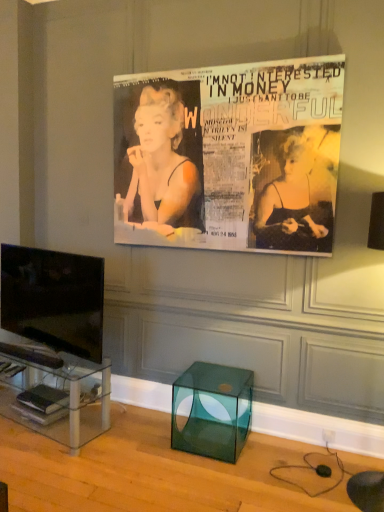
Question: In the image, is matte black poster at upper center on the left side or the right side of hardcover book at lower left, marked as the first magazine in a bottom-to-top arrangement?

Choices:
 (A) right
 (B) left

Answer: (A)

Question: Is point (236, 65) positioned closer to the camera than point (34, 414)?

Choices:
 (A) closer
 (B) farther

Answer: (A)

Question: Estimate the real-world distances between objects in this image. Which object is closer to the clear glass tv stand at lower left?

Choices:
 (A) hardcover book at lower left, marked as the first magazine in a bottom-to-top arrangement
 (B) matte black magazine at lower left, placed as the 2th magazine when sorted from bottom to top
 (C) black glossy tv at left
 (D) matte black poster at upper center
 (E) matte black magazine at lower left, acting as the 1th magazine starting from the top

Answer: (B)

Question: Which is farther from the transparent glass cube at lower center?

Choices:
 (A) black glossy tv at left
 (B) matte black magazine at lower left, which ranks as the second magazine in top-to-bottom order
 (C) matte black magazine at lower left, positioned as the third magazine in bottom-to-top order
 (D) matte black poster at upper center
 (E) clear glass tv stand at lower left

Answer: (D)